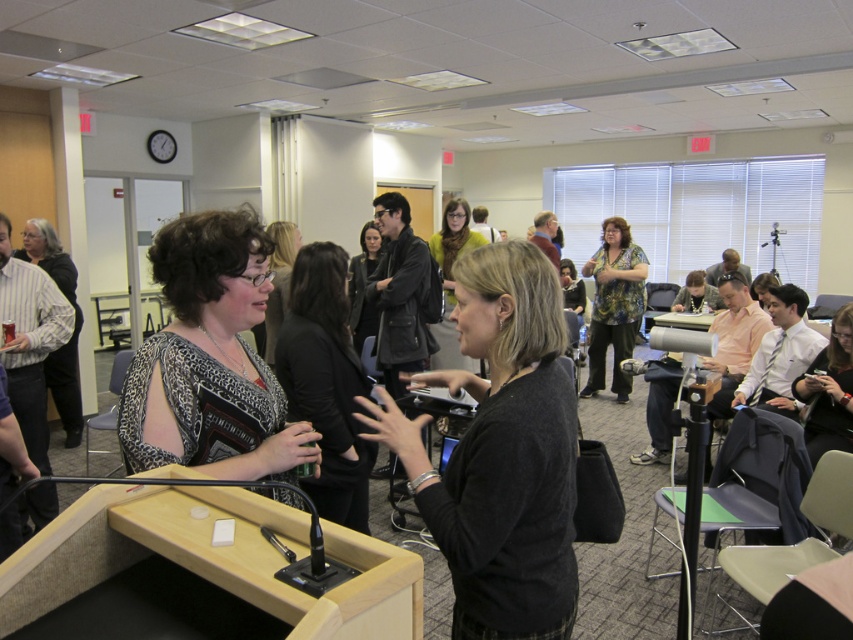
Question: Which point is closer to the camera?

Choices:
 (A) leather jacket at center
 (B) black matte sweater at center
 (C) leopard print dress at center
 (D) striped cotton shirt at left

Answer: (B)

Question: Does black matte sweater at center have a smaller size compared to leopard print dress at center?

Choices:
 (A) no
 (B) yes

Answer: (A)

Question: Is leopard print blouse at center positioned behind leather jacket at center?

Choices:
 (A) no
 (B) yes

Answer: (A)

Question: Which of these objects is positioned farthest from the black matte sweater at center?

Choices:
 (A) matte black phone at lower right
 (B) leopard print dress at center

Answer: (A)

Question: Does leopard print dress at center have a smaller size compared to matte black dress at center?

Choices:
 (A) no
 (B) yes

Answer: (B)

Question: Considering the real-world distances, which object is farthest from the striped cotton shirt at left?

Choices:
 (A) leopard print dress at center
 (B) black matte sweater at center
 (C) leather jacket at center

Answer: (B)